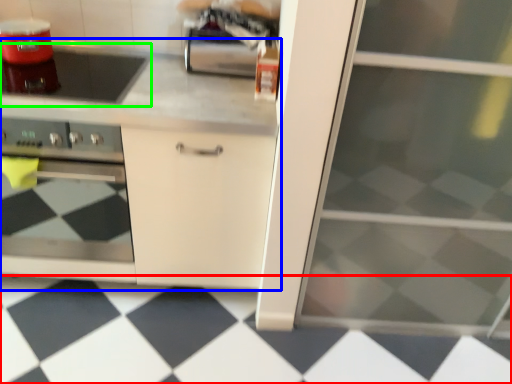
Question: Which is farther away from tile (highlighted by a red box)? cabinetry (highlighted by a blue box) or gas stove (highlighted by a green box)?

Choices:
 (A) cabinetry
 (B) gas stove

Answer: (B)